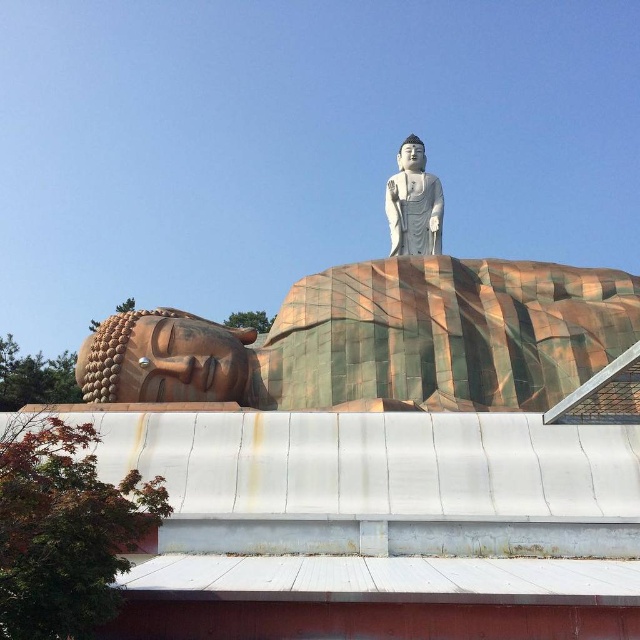
Question: Among these points, which one is farthest from the camera?

Choices:
 (A) (420, 225)
 (B) (193, 390)

Answer: (A)

Question: Can you confirm if gold textured statue at lower left is positioned to the right of white marble statue at upper center?

Choices:
 (A) no
 (B) yes

Answer: (A)

Question: Among these objects, which one is farthest from the camera?

Choices:
 (A) white marble statue at upper center
 (B) gold textured statue at lower left

Answer: (A)

Question: Is gold textured statue at lower left above white marble statue at upper center?

Choices:
 (A) no
 (B) yes

Answer: (A)

Question: Does gold textured statue at lower left have a larger size compared to white marble statue at upper center?

Choices:
 (A) no
 (B) yes

Answer: (B)

Question: Which object is closer to the camera taking this photo?

Choices:
 (A) white marble statue at upper center
 (B) gold textured statue at lower left

Answer: (B)